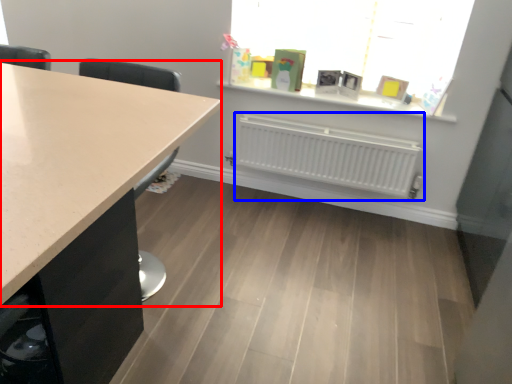
Question: Which object appears closest to the camera in this image, countertop (highlighted by a red box) or radiator (highlighted by a blue box)?

Choices:
 (A) countertop
 (B) radiator

Answer: (A)